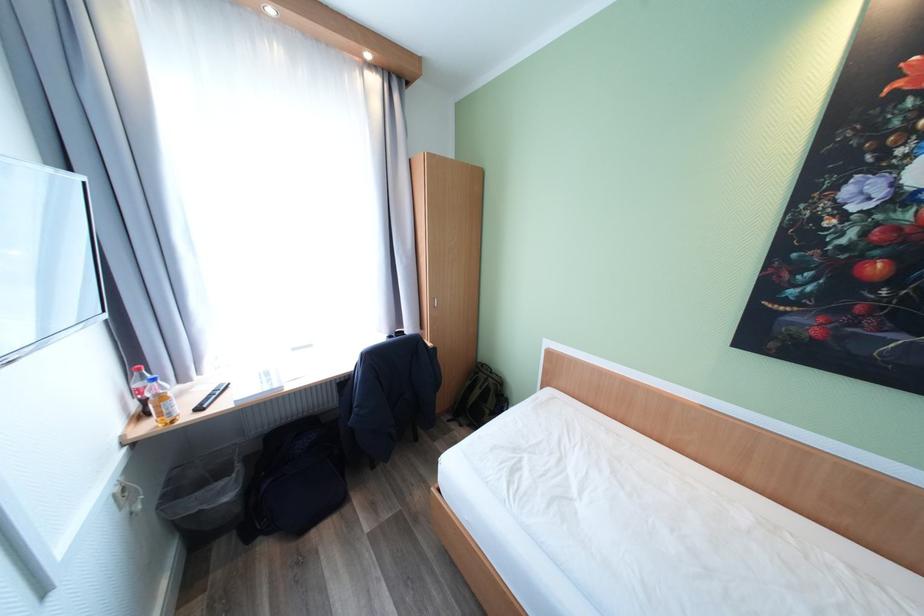
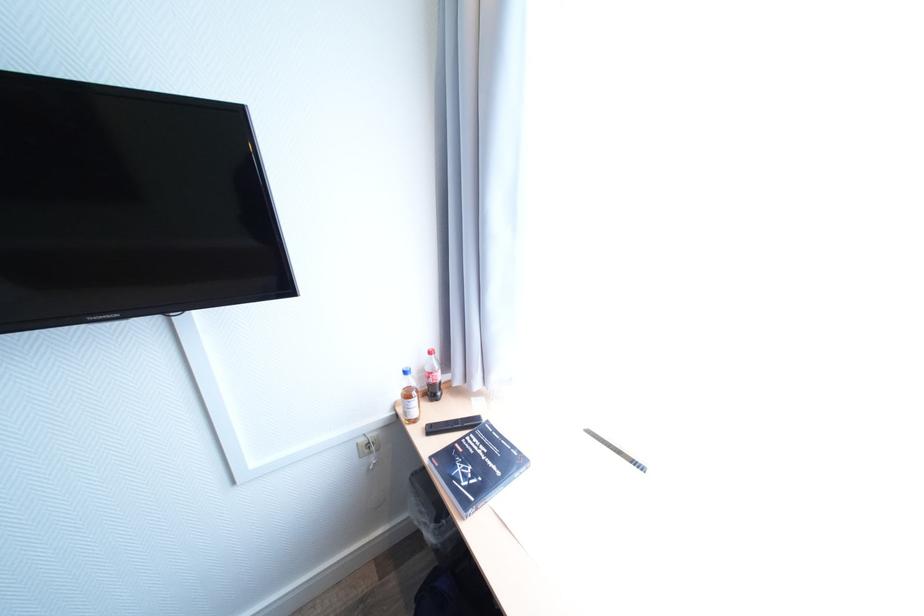
Locate, in the second image, the point that corresponds to pixel 129 438 in the first image.

(403, 403)